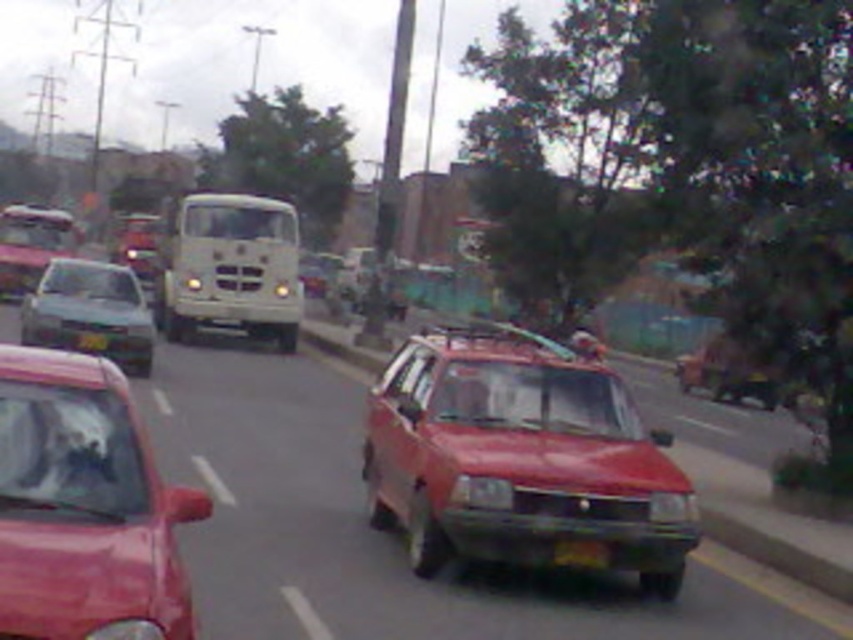
In the scene shown: Does shiny red car at center appear on the right side of black plastic license plate at center?

In fact, shiny red car at center is to the left of black plastic license plate at center.

Does shiny red car at center have a larger size compared to black plastic license plate at center?

Correct, shiny red car at center is larger in size than black plastic license plate at center.

Which is behind, point (585, 392) or point (573, 556)?

The point (585, 392) is more distant.

Locate an element on the screen. This screenshot has width=853, height=640. shiny red car at center is located at coordinates (520, 458).

Can you confirm if matte red car at left is taller than black plastic license plate at center?

Yes, matte red car at left is taller than black plastic license plate at center.

Where is `matte red car at left`? The width and height of the screenshot is (853, 640). matte red car at left is located at coordinates (85, 506).

Who is taller, shiny red car at center or matte red car at left?

Standing taller between the two is matte red car at left.

Is point (366, 474) farther from camera compared to point (106, 608)?

Yes, point (366, 474) is farther from viewer.

At what (x,y) coordinates should I click in order to perform the action: click on shiny red car at center. Please return your answer as a coordinate pair (x, y). This screenshot has height=640, width=853. Looking at the image, I should click on (520, 458).